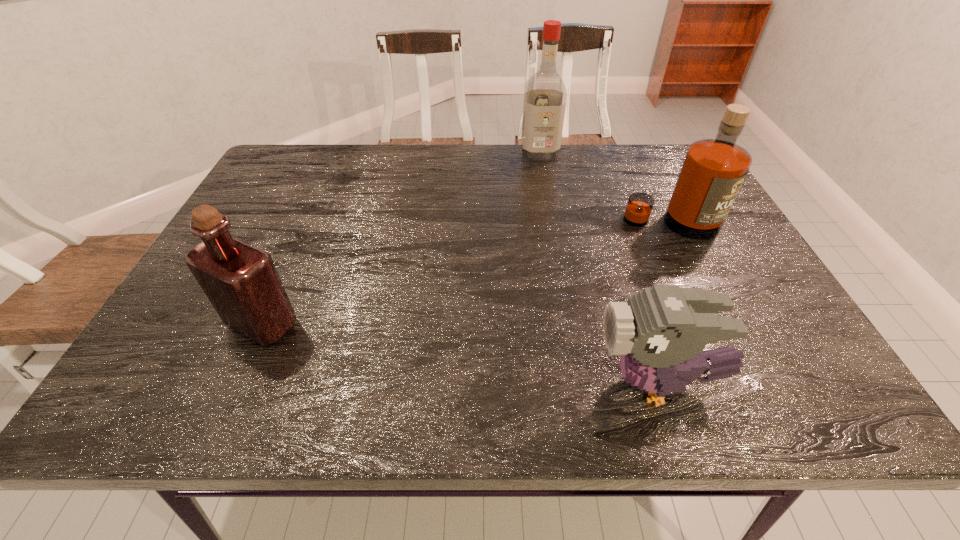
Where is `blank area located on the back of the leftmost object`? The image size is (960, 540). blank area located on the back of the leftmost object is located at coordinates click(x=313, y=211).

Locate an element on the screen. free region located 0.110m at the beak of the shortest object is located at coordinates point(532,383).

Where is `free space located 0.260m at the beak of the shortest object`? The height and width of the screenshot is (540, 960). free space located 0.260m at the beak of the shortest object is located at coordinates point(450,383).

This screenshot has height=540, width=960. What are the coordinates of `blank space located 0.220m at the beak of the shortest object` in the screenshot? It's located at (471, 383).

The width and height of the screenshot is (960, 540). I want to click on object that is at the far edge, so click(x=545, y=96).

I want to click on object that is at the near edge, so click(660, 332).

Find the location of `object that is at the left edge`. object that is at the left edge is located at coordinates (242, 283).

The height and width of the screenshot is (540, 960). Find the location of `object that is at the right edge`. object that is at the right edge is located at coordinates (713, 171).

Identify the location of vacant space at the far edge of the desktop. (627, 178).

Where is `vacant region at the near edge`? vacant region at the near edge is located at coordinates (573, 382).